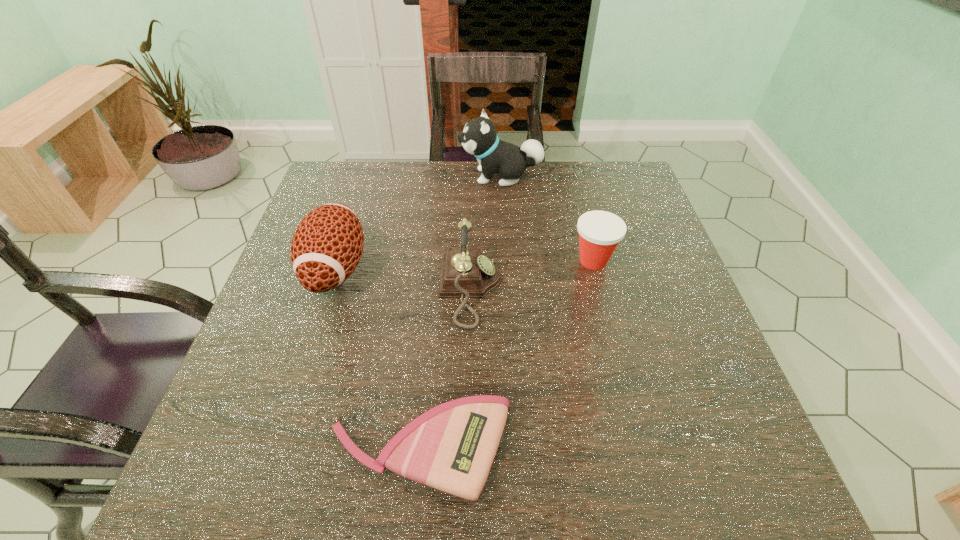
Where is `blank region between the wristlet and the rightmost object`? The width and height of the screenshot is (960, 540). blank region between the wristlet and the rightmost object is located at coordinates (507, 355).

This screenshot has width=960, height=540. What are the coordinates of `free point between the telephone and the wristlet` in the screenshot? It's located at (445, 370).

Image resolution: width=960 pixels, height=540 pixels. I want to click on free spot between the telephone and the farthest object, so click(486, 233).

Identify which object is the closest to the fourth tallest object. Please provide its 2D coordinates. Your answer should be formatted as a tuple, i.e. [(x, y)], where the tuple contains the x and y coordinates of a point satisfying the conditions above.

[(465, 273)]

Locate which object ranks fourth in proximity to the shortest object. Please provide its 2D coordinates. Your answer should be formatted as a tuple, i.e. [(x, y)], where the tuple contains the x and y coordinates of a point satisfying the conditions above.

[(479, 138)]

You are a GUI agent. You are given a task and a screenshot of the screen. Output one action in this format:
    pyautogui.click(x=<x>, y=<y>)
    Task: Click on the vacant point that satisfies the following two spatial constraints: 1. on the dial of the telephone; 2. on the front side of the nearest object
    The width and height of the screenshot is (960, 540).
    Given the screenshot: What is the action you would take?
    pyautogui.click(x=468, y=450)

Locate an element on the screen. Image resolution: width=960 pixels, height=540 pixels. free space that satisfies the following two spatial constraints: 1. on the front side of the wristlet; 2. on the left side of the leftmost object is located at coordinates (278, 450).